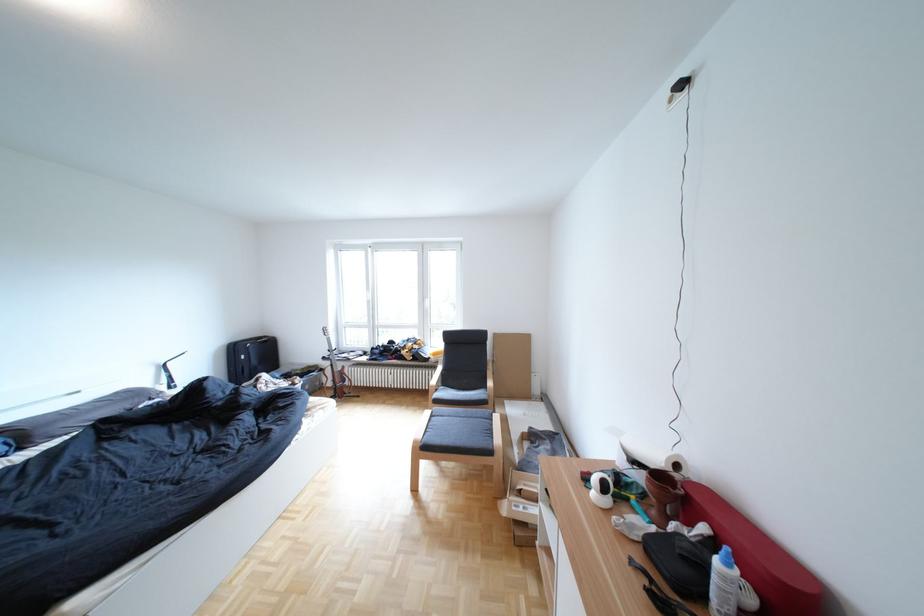
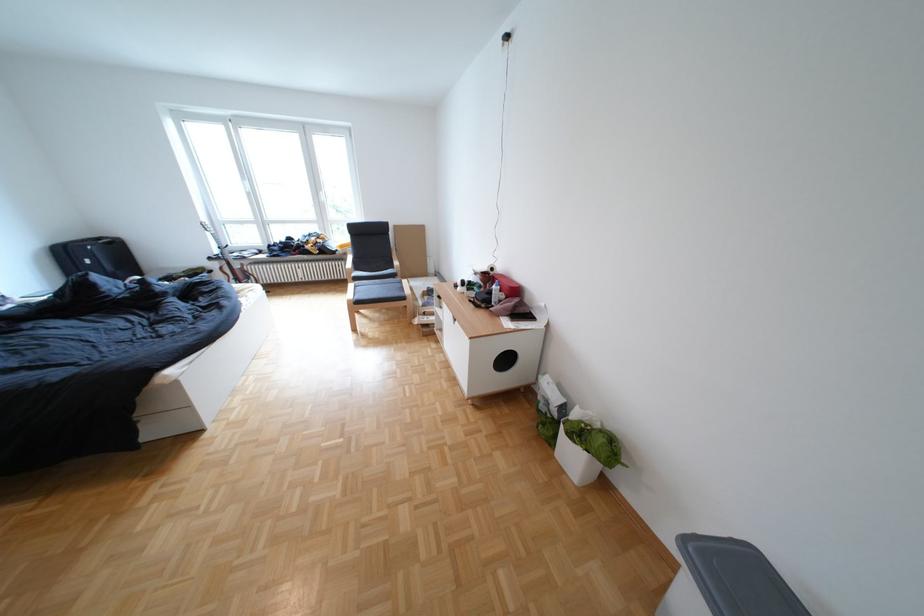
Locate, in the second image, the point that corresponds to point 339,359 in the first image.

(225, 259)